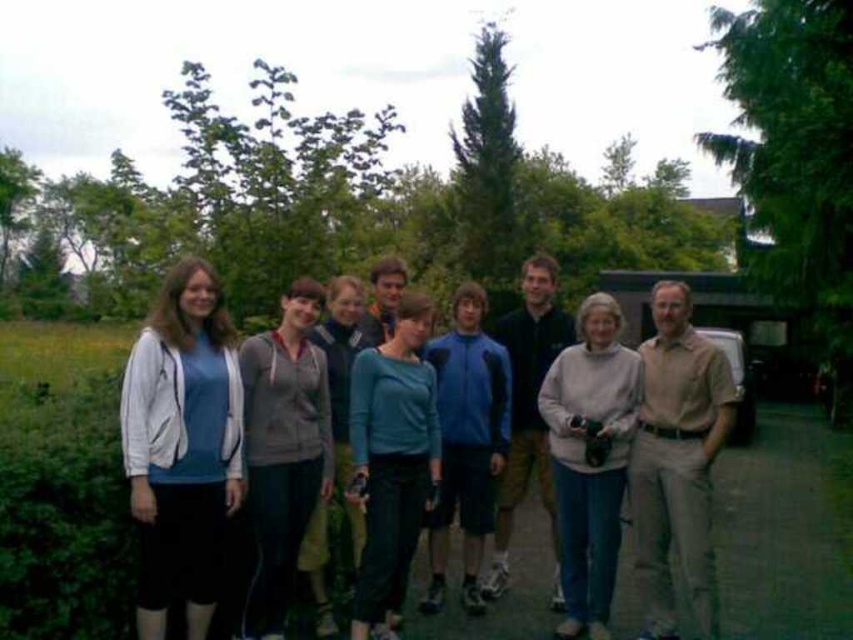
Is matte blue sweater at center thinner than tan cotton shirt at right?

In fact, matte blue sweater at center might be wider than tan cotton shirt at right.

Is point (184, 305) positioned before point (659, 298)?

Yes.

Describe the element at coordinates (225, 454) in the screenshot. Image resolution: width=853 pixels, height=640 pixels. I see `matte blue sweater at center` at that location.

I want to click on matte blue sweater at center, so click(225, 454).

Does matte gray hoodie at center appear on the left side of blue fleece jacket at center?

Yes, matte gray hoodie at center is to the left of blue fleece jacket at center.

Looking at this image, can you confirm if matte gray hoodie at center is positioned below blue fleece jacket at center?

Actually, matte gray hoodie at center is above blue fleece jacket at center.

This screenshot has height=640, width=853. I want to click on matte gray hoodie at center, so click(283, 451).

The height and width of the screenshot is (640, 853). What do you see at coordinates (181, 448) in the screenshot? I see `matte white jacket at left` at bounding box center [181, 448].

Which is more to the right, matte white jacket at left or teal matte sweater at center?

teal matte sweater at center

Identify the location of matte white jacket at left. click(x=181, y=448).

Identify the location of matte white jacket at left. (181, 448).